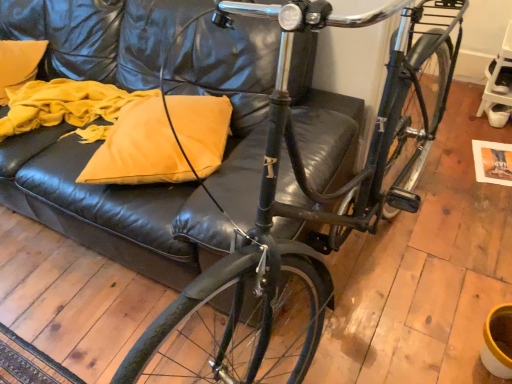
Question: Does matte yellow pillow at center have a smaller size compared to shiny black bicycle at center?

Choices:
 (A) yes
 (B) no

Answer: (A)

Question: Is matte yellow pillow at center shorter than shiny black bicycle at center?

Choices:
 (A) yes
 (B) no

Answer: (A)

Question: Is matte yellow pillow at center oriented towards shiny black bicycle at center?

Choices:
 (A) no
 (B) yes

Answer: (B)

Question: Can you confirm if matte yellow pillow at center is taller than shiny black bicycle at center?

Choices:
 (A) no
 (B) yes

Answer: (A)

Question: Is matte yellow pillow at center positioned before shiny black bicycle at center?

Choices:
 (A) no
 (B) yes

Answer: (A)

Question: From the image's perspective, is matte yellow pillow at center on top of shiny black bicycle at center?

Choices:
 (A) no
 (B) yes

Answer: (B)

Question: Is shiny black bicycle at center positioned behind matte yellow pillow at center?

Choices:
 (A) no
 (B) yes

Answer: (A)

Question: Is shiny black bicycle at center aimed at matte yellow pillow at center?

Choices:
 (A) no
 (B) yes

Answer: (A)

Question: Could matte yellow pillow at center be considered to be inside shiny black bicycle at center?

Choices:
 (A) no
 (B) yes

Answer: (A)

Question: Is shiny black bicycle at center completely or partially outside of matte yellow pillow at center?

Choices:
 (A) no
 (B) yes

Answer: (B)

Question: Is shiny black bicycle at center taller than matte yellow pillow at center?

Choices:
 (A) yes
 (B) no

Answer: (A)

Question: From the image's perspective, is shiny black bicycle at center below matte yellow pillow at center?

Choices:
 (A) yes
 (B) no

Answer: (A)

Question: Based on their sizes in the image, would you say matte yellow pillow at center is bigger or smaller than shiny black bicycle at center?

Choices:
 (A) big
 (B) small

Answer: (B)